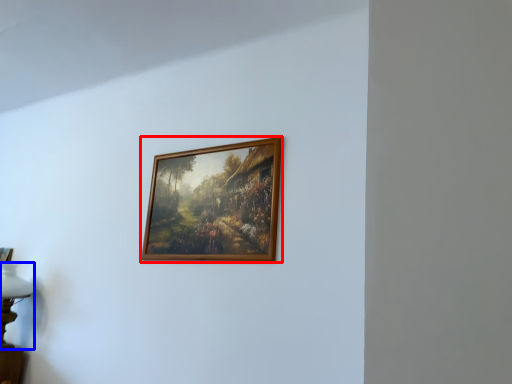
Question: Which object is closer to the camera taking this photo, picture frame (highlighted by a red box) or table lamp (highlighted by a blue box)?

Choices:
 (A) picture frame
 (B) table lamp

Answer: (A)